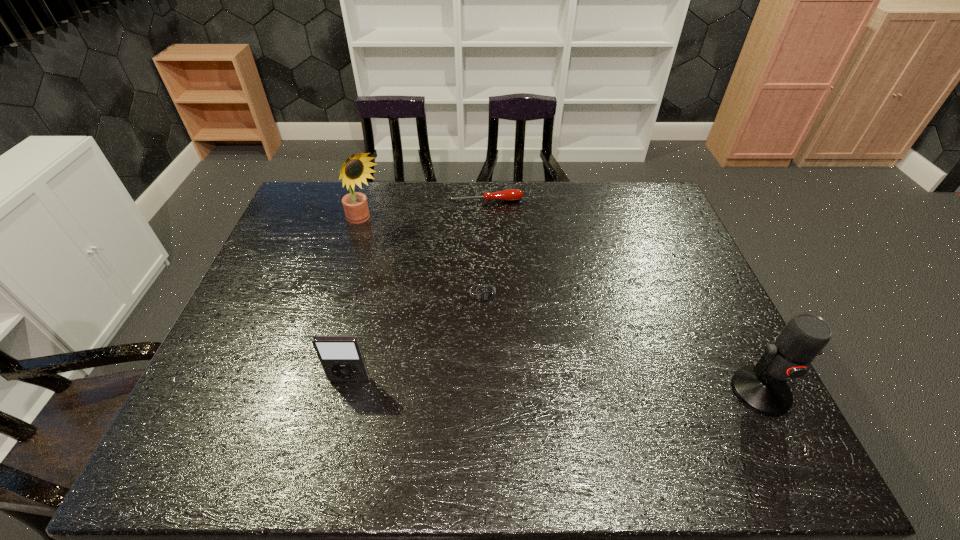
At what (x,y) coordinates should I click in order to perform the action: click on free space on the desktop that is between the third shortest object and the rightmost object and is positioned at the tip of the second shortest object. Please return your answer as a coordinate pair (x, y). Looking at the image, I should click on (518, 384).

Where is `free space on the desktop that is between the third shortest object and the microphone and is positioned on the face of the shortest object`? free space on the desktop that is between the third shortest object and the microphone and is positioned on the face of the shortest object is located at coordinates (510, 384).

The height and width of the screenshot is (540, 960). I want to click on free space on the desktop that is between the third shortest object and the microphone and is positioned on the face of the sunflower, so coord(566,386).